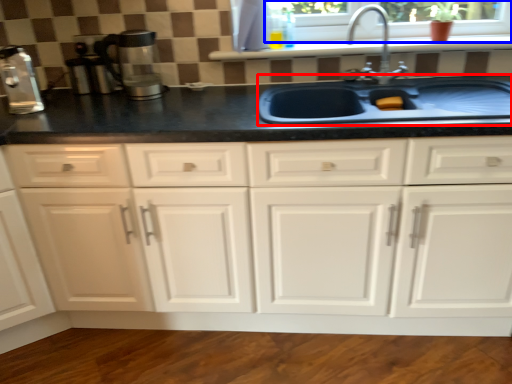
Question: Which of the following is the closest to the observer, sink (highlighted by a red box) or window frame (highlighted by a blue box)?

Choices:
 (A) sink
 (B) window frame

Answer: (A)